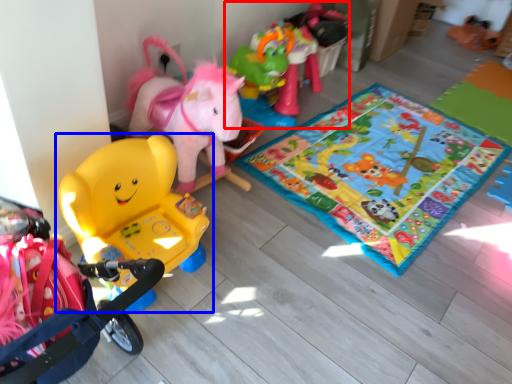
Question: Which object appears closest to the camera in this image, toy (highlighted by a red box) or toy (highlighted by a blue box)?

Choices:
 (A) toy
 (B) toy

Answer: (B)